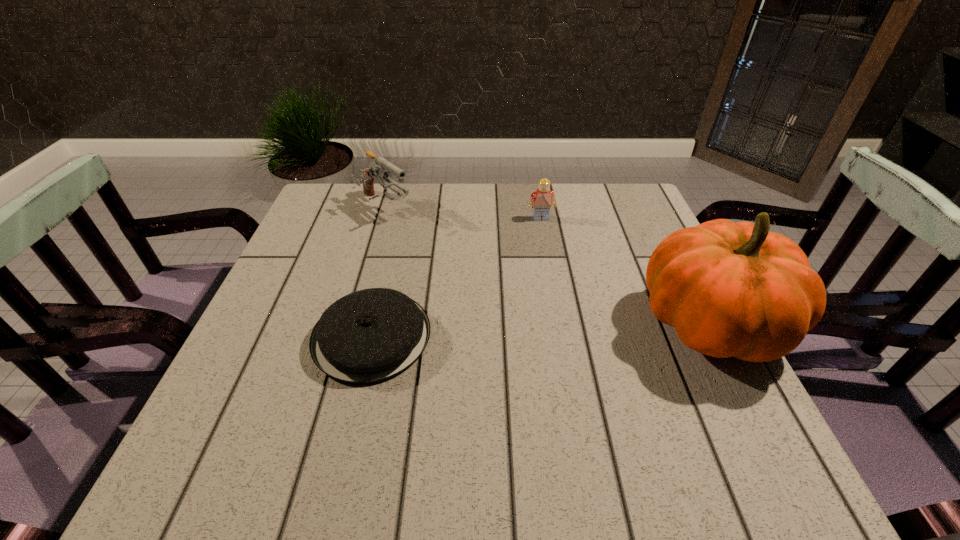
Where is `free space on the desktop that is between the pancake and the tallest object and is positioned on the front-facing side of the second shortest object`? free space on the desktop that is between the pancake and the tallest object and is positioned on the front-facing side of the second shortest object is located at coordinates pos(576,329).

I want to click on vacant space on the desktop that is between the shortest object and the pumpkin and is positioned at the barrel end of the gun, so click(546, 330).